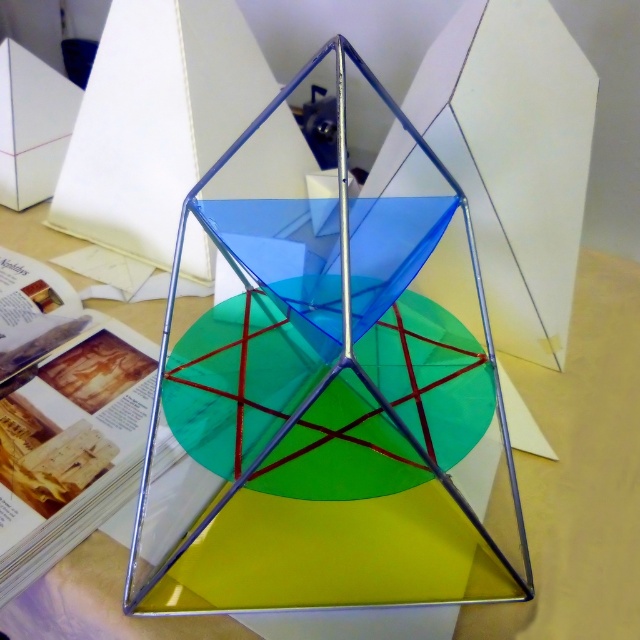
You are looking at the geometric model from the front. Which object is closer to you between the transparent glass cube at center and the transparent glass table at center?

The transparent glass cube at center is closer to the viewer than the transparent glass table at center.

You are an architect designing a new installation. You have a transparent glass cube at center and a transparent glass table at center in front of you. Which object would require more space to accommodate its size?

The transparent glass cube at center is larger in size than the transparent glass table at center, so it would require more space to accommodate its size.

You are arranging a display and need to place a small statue on the transparent glass table at center. The statue requires a spot that is not directly under the transparent glass cube at center. Based on the scene description, where should you position the statue on the table?

Since the transparent glass cube at center is to the left of the transparent glass table at center, you should position the statue on the right side of the transparent glass table at center to avoid placing it directly under the cube.